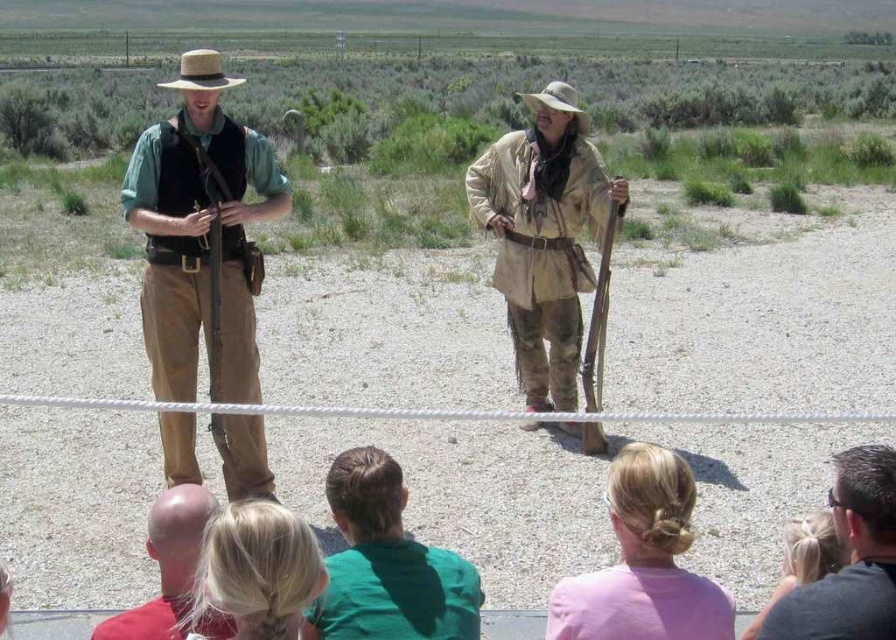
You are standing in the desert scene and want to take a photo of the blonde hair at lower center. If your camera has a maximum focus range of 3 meters, will you be able to capture it clearly?

The blonde hair at lower center is 3.11 meters away from the viewer. Since the camera can only focus up to 3 meters, it won not be able to capture the blonde hair at lower center clearly.

You are standing at the point marked as point (837, 464) in the image. The distance from you to the nearest historical reenactor is 3.72 meters. Can you safely walk towards them without crossing the white rope barrier?

The distance of point (837, 464) from viewer is 3.72 meters. Since the white rope barrier is between you and the historical reenactors, you must stay behind it. Therefore, you cannot safely walk towards them without crossing the barrier.